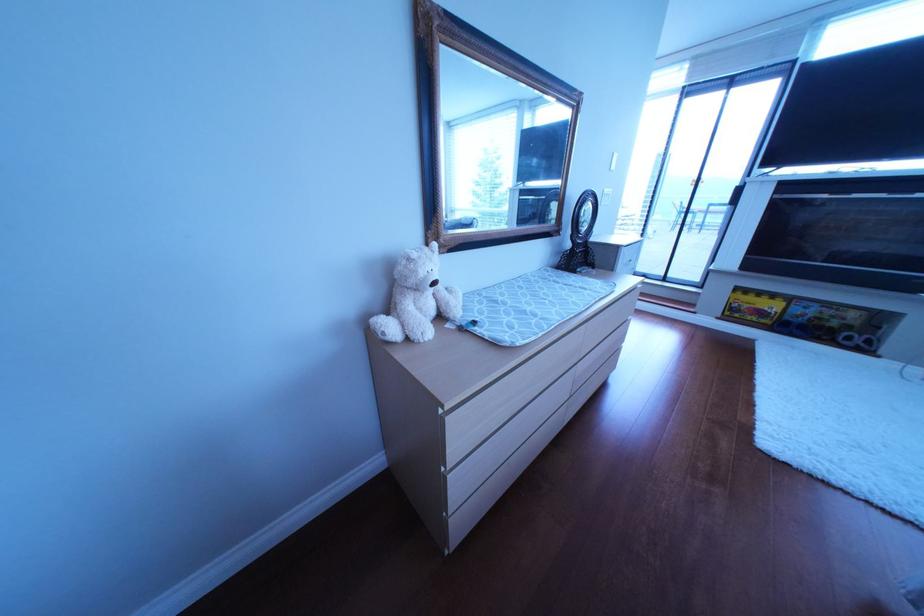
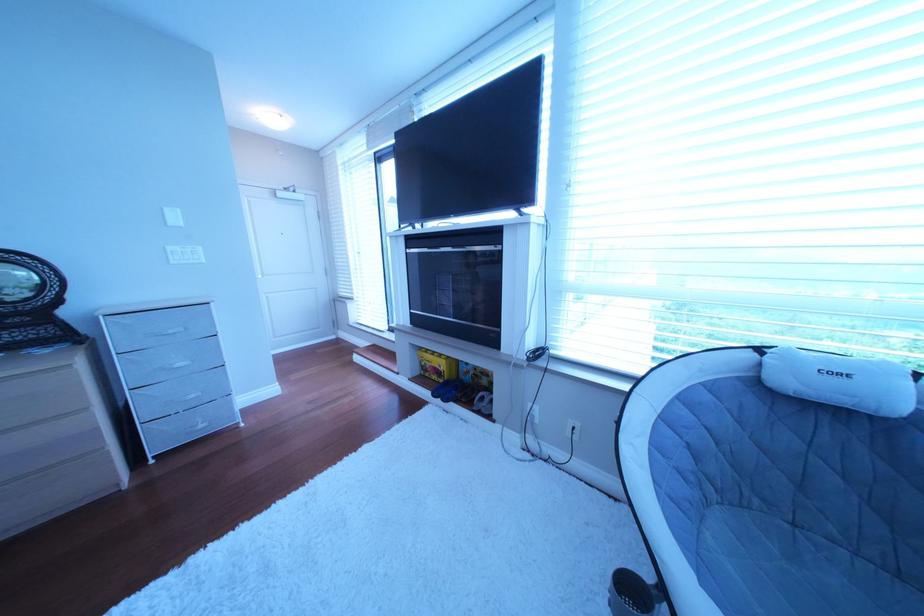
Where in the second image is the point corresponding to (761,308) from the first image?

(444, 367)